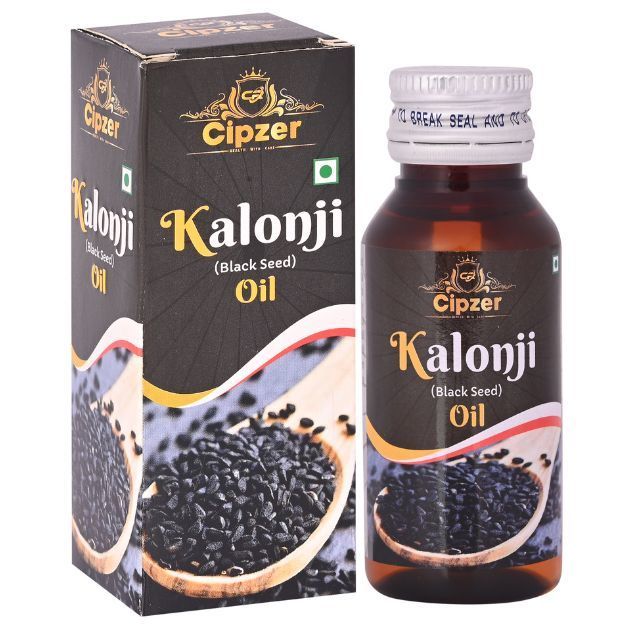
Locate an element on the screen. The image size is (625, 625). box is located at coordinates (230, 302).